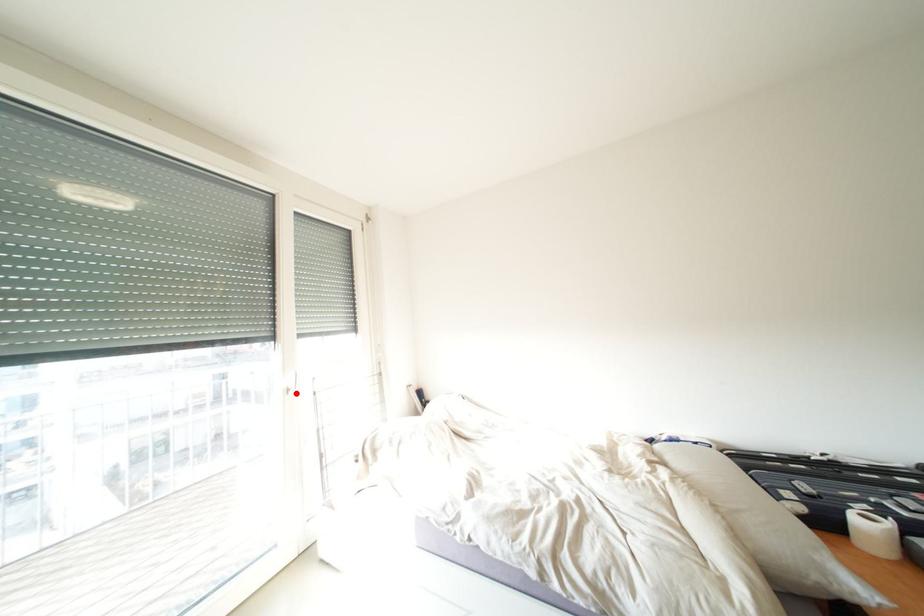
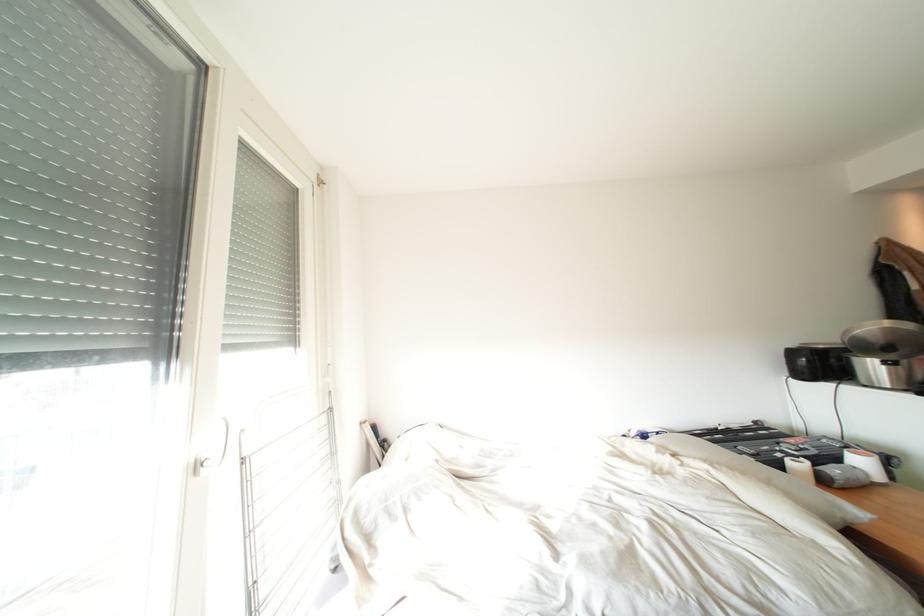
Find the pixel in the second image that matches the highlighted location in the first image.

(205, 469)